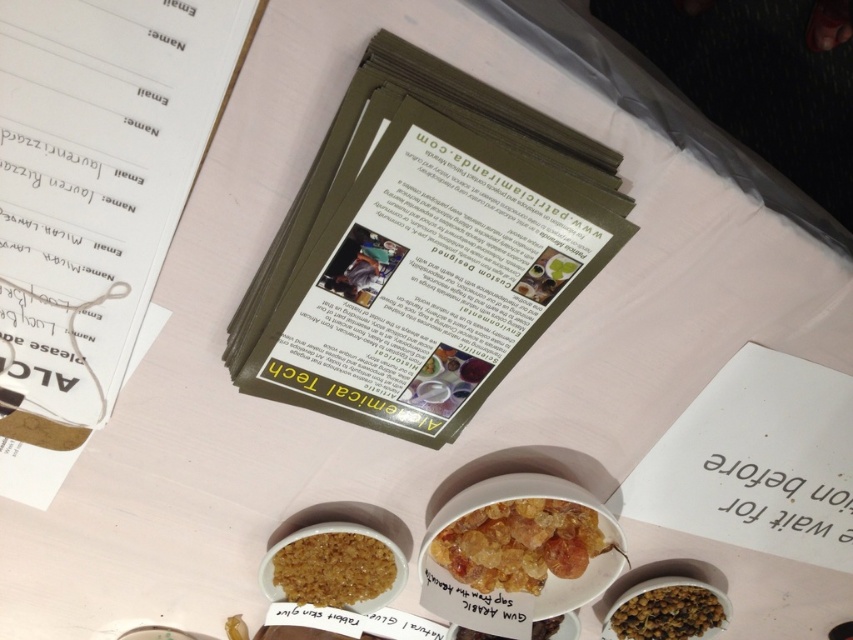
Question: Is brown matte bowl at lower right thinner than translucent amber cube at center?

Choices:
 (A) no
 (B) yes

Answer: (A)

Question: Does olive green paper at center have a smaller size compared to brown matte bowl at lower right?

Choices:
 (A) yes
 (B) no

Answer: (B)

Question: Which point appears closest to the camera in this image?

Choices:
 (A) (386, 561)
 (B) (541, 625)
 (C) (627, 612)

Answer: (A)

Question: Which of these objects is positioned closest to the brown crumbly substance at center?

Choices:
 (A) translucent amber crystals at center
 (B) olive green paper at center
 (C) translucent amber cube at center
 (D) brown matte bowl at lower right

Answer: (A)

Question: Can you confirm if brown crumbly substance at center is positioned below translucent amber cube at center?

Choices:
 (A) no
 (B) yes

Answer: (A)

Question: Which point is closer to the camera taking this photo?

Choices:
 (A) (80, 45)
 (B) (376, 586)

Answer: (A)